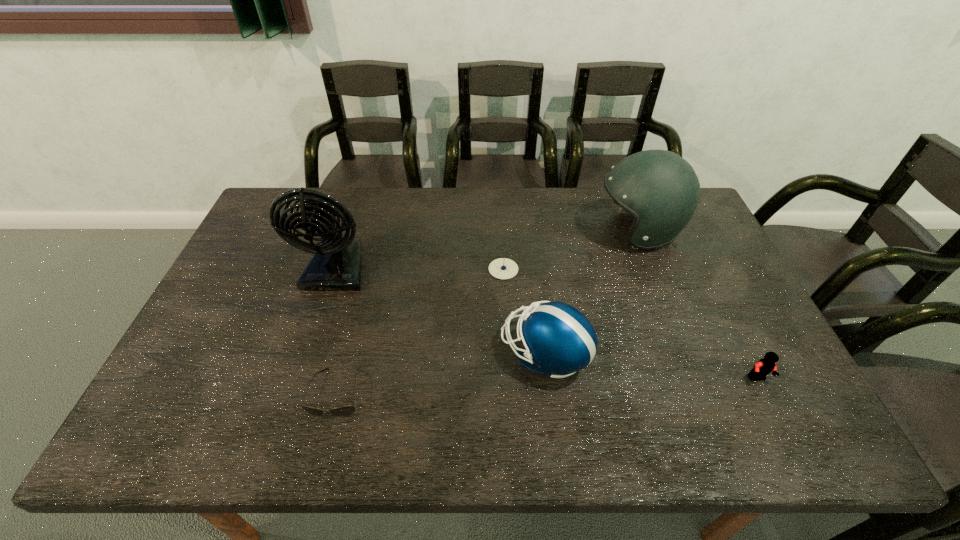
Identify the location of fan. This screenshot has height=540, width=960. (336, 265).

Where is `the right football helmet`? The width and height of the screenshot is (960, 540). the right football helmet is located at coordinates (661, 190).

At what (x,y) coordinates should I click in order to perform the action: click on the farther football helmet. Please return your answer as a coordinate pair (x, y). Looking at the image, I should click on (661, 190).

Find the location of a particular element. This screenshot has width=960, height=540. the nearer football helmet is located at coordinates (558, 339).

Locate an element on the screen. the shorter football helmet is located at coordinates [558, 339].

This screenshot has height=540, width=960. I want to click on Lego, so click(x=765, y=366).

You are a GUI agent. You are given a task and a screenshot of the screen. Output one action in this format:
    pyautogui.click(x=<x>, y=<y>)
    Task: Click on the compass
    Image resolution: width=960 pixels, height=540 pixels.
    Given the screenshot: What is the action you would take?
    pyautogui.click(x=502, y=268)

Locate an element on the screen. sunglasses is located at coordinates (343, 411).

The image size is (960, 540). Identify the location of vacant space located 0.080m in front of the fan to blow air. (322, 318).

At what (x,y) coordinates should I click in order to perform the action: click on free space located at the face opening of the taller football helmet. Please return your answer as a coordinate pair (x, y). Looking at the image, I should click on (521, 231).